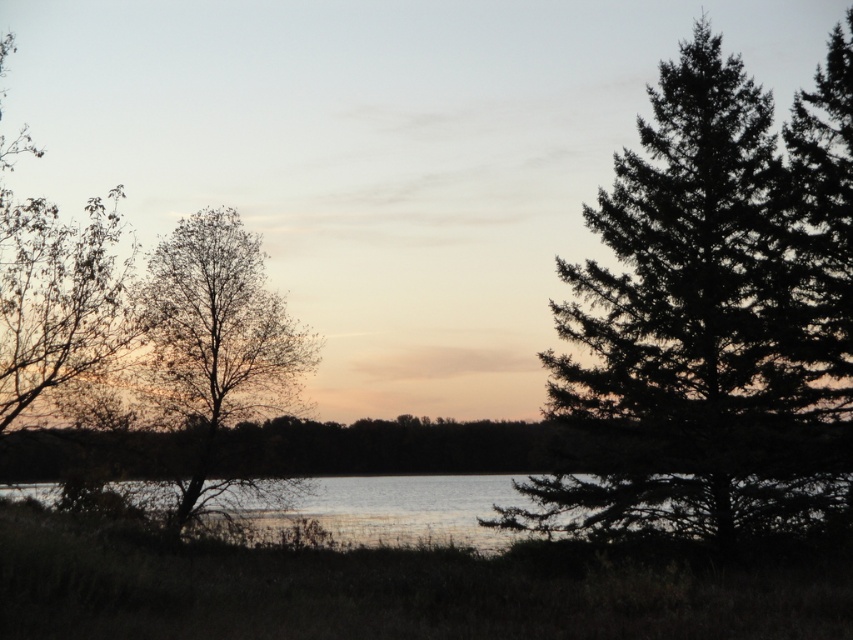
Question: Which point is closer to the camera?

Choices:
 (A) bare branches at left
 (B) clear water at center
 (C) dark green textured pine tree at right
 (D) brown leafy tree at left

Answer: (D)

Question: Is brown leafy tree at left to the right of clear water at center from the viewer's perspective?

Choices:
 (A) no
 (B) yes

Answer: (A)

Question: Is bare branches at left smaller than clear water at center?

Choices:
 (A) no
 (B) yes

Answer: (A)

Question: Based on their relative distances, which object is farther from the clear water at center?

Choices:
 (A) bare branches at left
 (B) dark green textured pine tree at right

Answer: (B)

Question: Which point is closer to the camera taking this photo?

Choices:
 (A) (358, 524)
 (B) (657, 305)
 (C) (236, 216)
 (D) (9, 285)

Answer: (D)

Question: Does bare branches at left have a larger size compared to clear water at center?

Choices:
 (A) no
 (B) yes

Answer: (B)